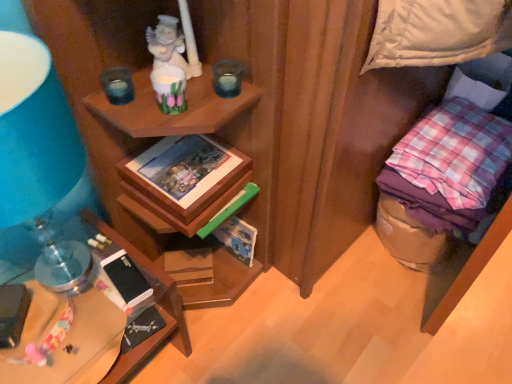
Question: From the image's perspective, would you say brown cardboard magazine at lower center is shown under black matte mobile phone at lower left, which is counted as the second mobile phone, starting from the right?

Choices:
 (A) no
 (B) yes

Answer: (B)

Question: Is brown cardboard magazine at lower center looking in the opposite direction of black matte mobile phone at lower left, the first mobile phone viewed from the left?

Choices:
 (A) yes
 (B) no

Answer: (B)

Question: Can you confirm if brown cardboard magazine at lower center is smaller than black matte mobile phone at lower left, the first mobile phone viewed from the left?

Choices:
 (A) no
 (B) yes

Answer: (B)

Question: Can black matte mobile phone at lower left, which is counted as the second mobile phone, starting from the right, be found inside brown cardboard magazine at lower center?

Choices:
 (A) no
 (B) yes

Answer: (A)

Question: Considering the relative sizes of brown cardboard magazine at lower center and black matte mobile phone at lower left, which is counted as the second mobile phone, starting from the right, in the image provided, is brown cardboard magazine at lower center taller than black matte mobile phone at lower left, which is counted as the second mobile phone, starting from the right,?

Choices:
 (A) no
 (B) yes

Answer: (A)

Question: From the image's perspective, is white glossy cup at upper center, the 2th candle holder in the right-to-left sequence, above or below wooden desk at lower left?

Choices:
 (A) above
 (B) below

Answer: (A)

Question: Visually, is white glossy cup at upper center, the 2th candle holder in the right-to-left sequence, positioned to the left or to the right of wooden desk at lower left?

Choices:
 (A) right
 (B) left

Answer: (A)

Question: Is white glossy cup at upper center, the 2th candle holder in the right-to-left sequence, spatially inside wooden desk at lower left, or outside of it?

Choices:
 (A) outside
 (B) inside

Answer: (A)

Question: Is point (168, 87) closer or farther from the camera than point (95, 357)?

Choices:
 (A) closer
 (B) farther

Answer: (A)

Question: Is point (x=0, y=332) closer or farther from the camera than point (x=122, y=84)?

Choices:
 (A) closer
 (B) farther

Answer: (B)

Question: From the image's perspective, relative to translucent glass candle at upper center, the first candle holder in the left-to-right sequence, is black matte mobile phone at lower left, the first mobile phone viewed from the left, above or below?

Choices:
 (A) below
 (B) above

Answer: (A)

Question: In the image, is black matte mobile phone at lower left, which is counted as the second mobile phone, starting from the right, on the left side or the right side of translucent glass candle at upper center, the first candle holder in the left-to-right sequence?

Choices:
 (A) right
 (B) left

Answer: (B)

Question: From a real-world perspective, is black matte mobile phone at lower left, which is counted as the second mobile phone, starting from the right, above or below translucent glass candle at upper center, the first candle holder in the left-to-right sequence?

Choices:
 (A) above
 (B) below

Answer: (B)

Question: Choose the correct answer: Is brown cardboard magazine at lower center inside pink checkered fabric at right or outside it?

Choices:
 (A) inside
 (B) outside

Answer: (B)

Question: Considering the positions of brown cardboard magazine at lower center and pink checkered fabric at right in the image, is brown cardboard magazine at lower center wider or thinner than pink checkered fabric at right?

Choices:
 (A) wide
 (B) thin

Answer: (B)